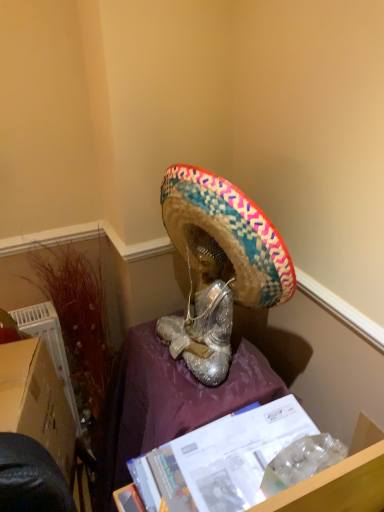
Image resolution: width=384 pixels, height=512 pixels. Identify the location of vacant point above white glossy magazine at lower center (from a real-world perspective). (207, 472).